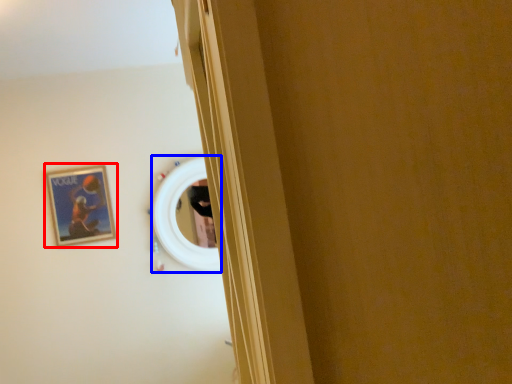
Question: Which point is further to the camera, picture frame (highlighted by a red box) or mirror (highlighted by a blue box)?

Choices:
 (A) picture frame
 (B) mirror

Answer: (B)